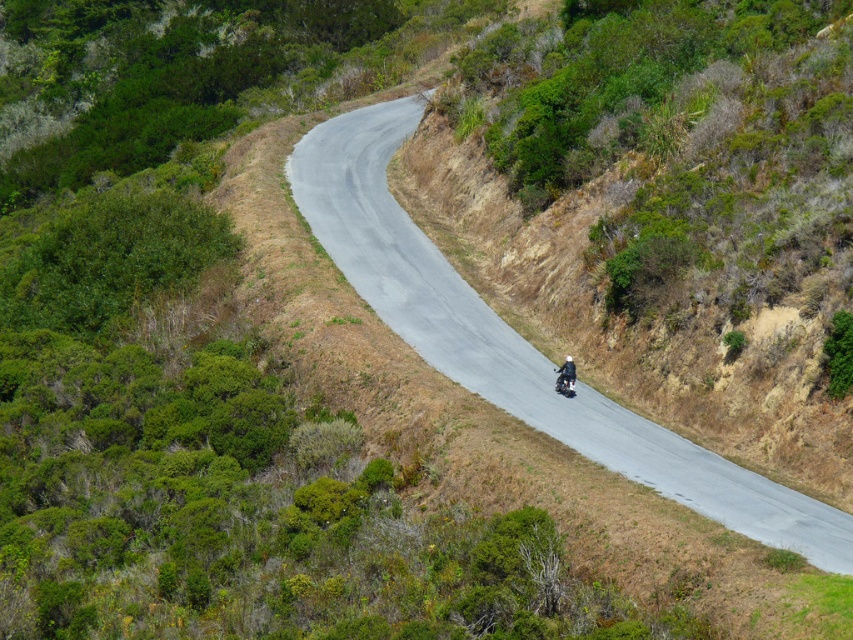
You are a hiker standing at the starting point of the gray asphalt road at center and want to reach the shiny black motorcycle at center. Which direction should you head to move towards the motorcycle?

The gray asphalt road at center is to the left of the shiny black motorcycle at center, so you should head to the right to move towards the motorcycle.

You are standing at the camera position and want to reach the point marked at coordinates (373, 268). The road ahead is 150 feet wide. Can you walk straight ahead to reach the point without crossing the road?

The point marked at coordinates (373, 268) is 169.30 feet away from the camera. Since the road is only 150 feet wide, walking straight ahead would take you beyond the road before reaching the point. Therefore, you would need to cross the road to reach the point.